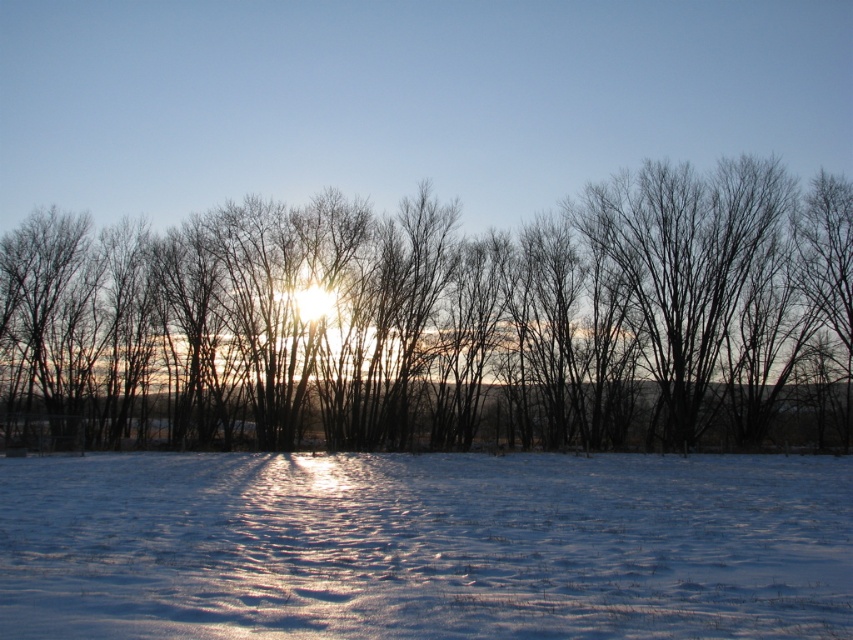
You are an observer standing in the winter landscape. You see the bare branches at center and the white powdery snow at lower center. Which object is located to the left of the other?

The bare branches at center is positioned on the left side of white powdery snow at lower center.

You are an observer standing in the winter landscape. You notice the bare branches at center and the white powdery snow at lower center. Which object is located above the other?

The bare branches at center is positioned over white powdery snow at lower center.